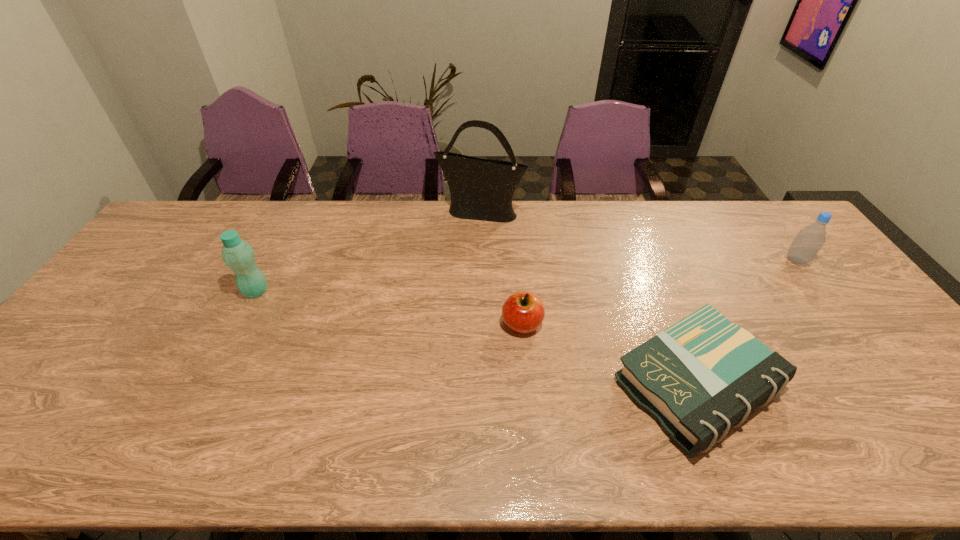
Find the location of `shoulder bag`. shoulder bag is located at coordinates (481, 189).

The height and width of the screenshot is (540, 960). Identify the location of the tallest object. (481, 189).

This screenshot has width=960, height=540. What are the coordinates of `the nearer bottle` in the screenshot? It's located at (237, 254).

In order to click on the third nearest object in this screenshot , I will do `click(237, 254)`.

Locate an element on the screen. This screenshot has width=960, height=540. the farther bottle is located at coordinates (809, 240).

Image resolution: width=960 pixels, height=540 pixels. I want to click on the fourth nearest object, so click(809, 240).

I want to click on apple, so click(523, 312).

At what (x,y) coordinates should I click in order to perform the action: click on paperback book. Please return your answer as a coordinate pair (x, y). This screenshot has width=960, height=540. Looking at the image, I should click on (703, 375).

Locate an element on the screen. This screenshot has width=960, height=540. free space located on the right of the shoulder bag is located at coordinates (559, 212).

Locate an element on the screen. The height and width of the screenshot is (540, 960). free space located 0.150m on the back of the nearer bottle is located at coordinates (276, 250).